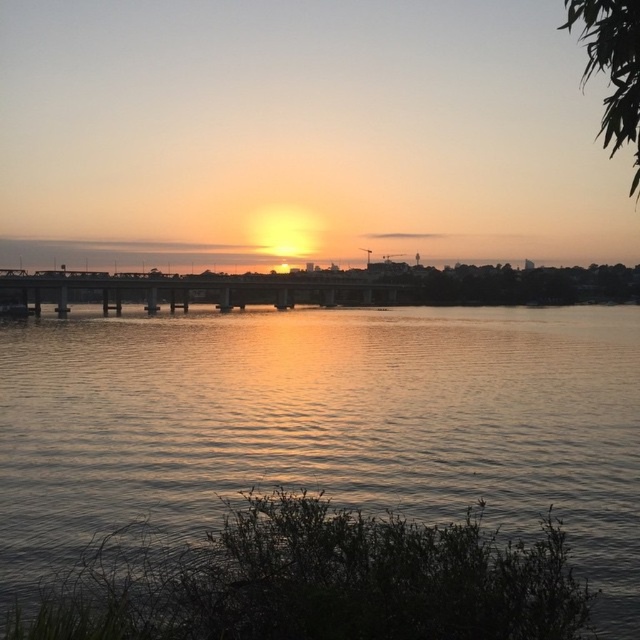
You are an architect designing a new pedestrian bridge. You observe the image and notice the silvery reflective water at center and the metallic bridge at center. Which object in the scene is larger?

The metallic bridge at center is larger than the silvery reflective water at center.

You are standing on the shore of the lake and want to take a photo of both the silvery reflective water at center and the metallic bridge at center. Which object should you adjust your camera focus to first if you want both to be in clear view?

Since the silvery reflective water at center is in front of the metallic bridge at center, you should focus on the silvery reflective water at center first to ensure both are in clear view.

You are a photographer aiming to capture the sunset reflection on the silvery reflective water at center. However, the metallic bridge at center is blocking your view. Can you determine if the water surface is tall enough to be seen above the bridge?

The silvery reflective water at center is shorter than the metallic bridge at center, so the water surface is not tall enough to be seen above the bridge, making it difficult to capture the reflection without obstruction.